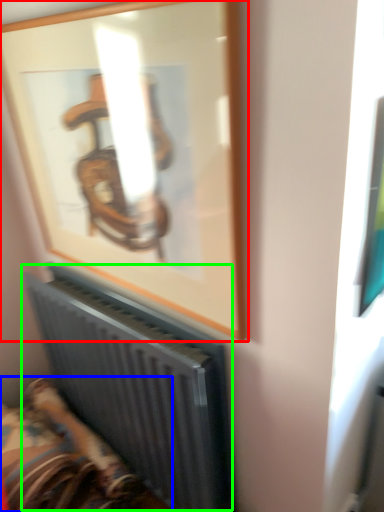
Question: Considering the real-world distances, which object is farthest from picture frame (highlighted by a red box)? furniture (highlighted by a blue box) or radiator (highlighted by a green box)?

Choices:
 (A) furniture
 (B) radiator

Answer: (A)